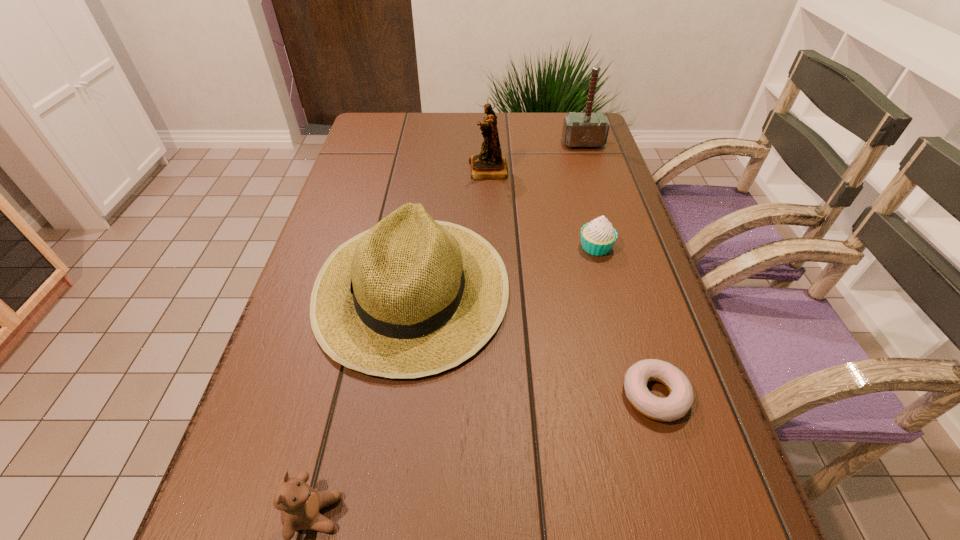
This screenshot has height=540, width=960. I want to click on the farthest object, so click(587, 129).

I want to click on the second farthest object, so click(490, 164).

What are the coordinates of `the fourth shortest object` in the screenshot? It's located at (411, 297).

At what (x,y) coordinates should I click in order to perform the action: click on the fifth tallest object. Please return your answer as a coordinate pair (x, y). Image resolution: width=960 pixels, height=540 pixels. Looking at the image, I should click on (598, 236).

Locate an element on the screen. doughnut is located at coordinates (x=675, y=406).

Locate an element on the screen. vacant space located 0.220m on the front of the farthest object is located at coordinates 599,194.

Locate an element on the screen. Image resolution: width=960 pixels, height=540 pixels. free region located 0.100m on the front-facing side of the figurine is located at coordinates (433, 170).

You are a GUI agent. You are given a task and a screenshot of the screen. Output one action in this format:
    pyautogui.click(x=<x>, y=<y>)
    Task: Click on the free point located 0.330m on the front-facing side of the figurine
    
    Given the screenshot: What is the action you would take?
    pyautogui.click(x=350, y=170)

The height and width of the screenshot is (540, 960). I want to click on vacant area situated 0.130m on the front-facing side of the figurine, so click(x=421, y=170).

Locate an element on the screen. The width and height of the screenshot is (960, 540). vacant region located 0.070m on the right of the sunhat is located at coordinates (542, 288).